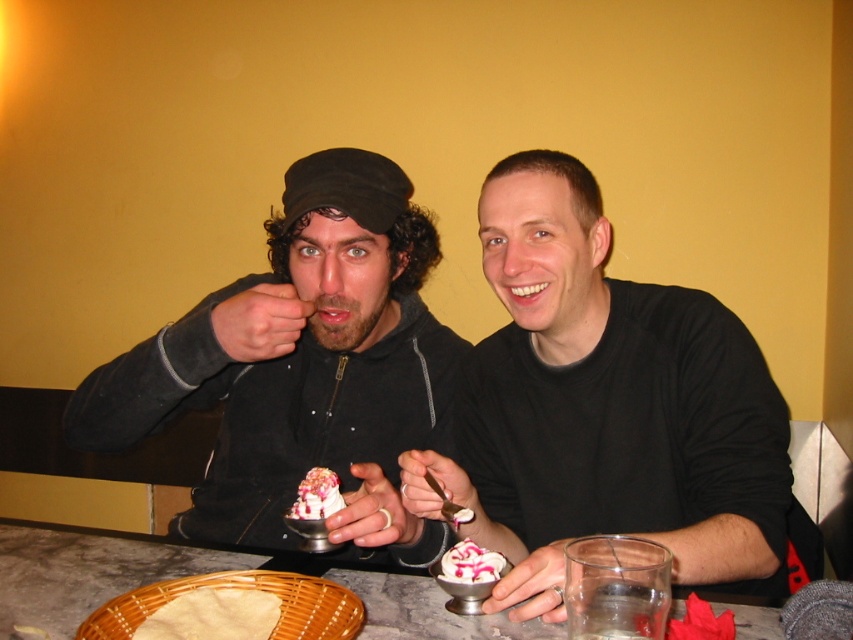
You are a photographer setting up a shoot at the table. You need to place a small prop on the black matte shirt at center so that it stays visible but doesn not obstruct the marble table at center. Is this possible given their current positions?

The black matte shirt at center is positioned over the marble table at center, so placing a prop on the shirt would naturally keep it visible without blocking the table underneath.

You are taking a photo of the two people at the table. You want to focus on the point closer to the camera between the two points labeled as point [252,557] and point [297,506]. Which point should you focus on?

You should focus on point [252,557] because it is closer to the camera compared to point [297,506].

You are a photographer trying to capture a closeup of the black matte shirt at center. Based on its position coordinates, where should you aim your camera?

The black matte shirt at center is located at point coordinates 0.637 on the x axis and 0.710 on the y axis. Aim your camera at those coordinates to capture the shirt.